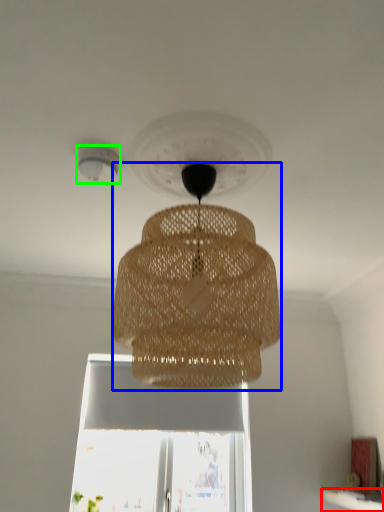
Question: Based on their relative distances, which object is farther from window sill (highlighted by a red box)? Choose from lamp (highlighted by a blue box) and lighting (highlighted by a green box).

Choices:
 (A) lamp
 (B) lighting

Answer: (B)